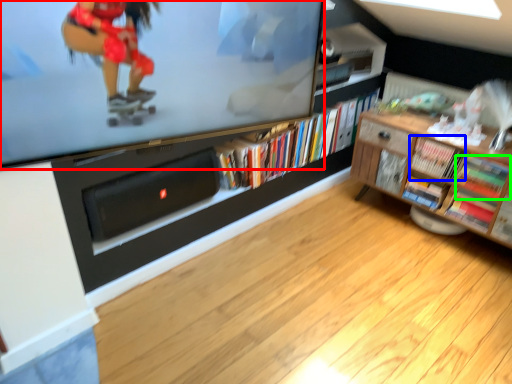
Question: Based on their relative distances, which object is nearer to television (highlighted by a red box)? Choose from book (highlighted by a blue box) and book (highlighted by a green box).

Choices:
 (A) book
 (B) book

Answer: (A)